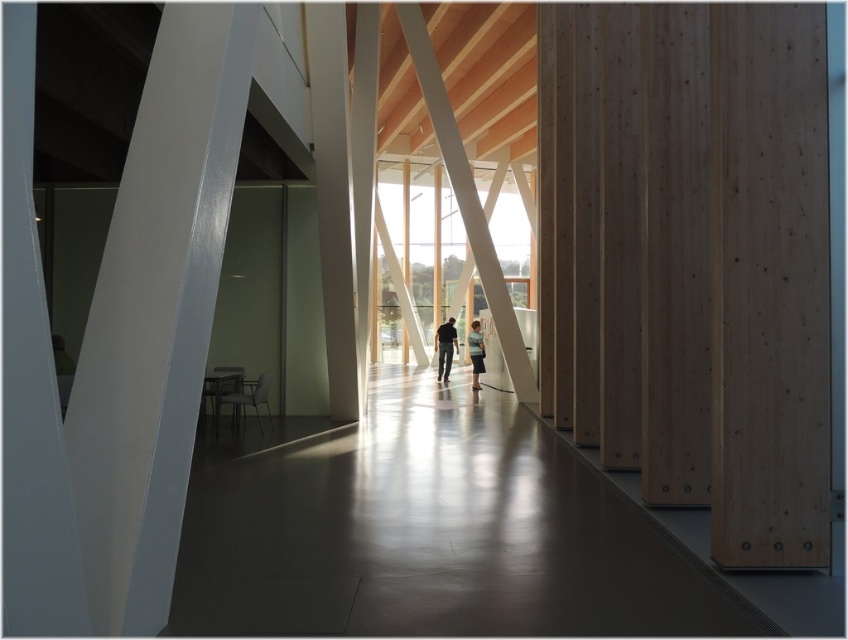
Question: Which of the following is the closest to the observer?

Choices:
 (A) light brown wooden beam at center
 (B) white glossy beam at left
 (C) matte black shirt at center

Answer: (B)

Question: Observing the image, what is the correct spatial positioning of light brown wooden beam at center in reference to matte black shirt at center?

Choices:
 (A) right
 (B) left

Answer: (A)

Question: Can you confirm if light brown wooden beam at center is positioned to the right of light blue denim jacket at center?

Choices:
 (A) no
 (B) yes

Answer: (B)

Question: Which of the following is the closest to the observer?

Choices:
 (A) (85, 460)
 (B) (456, 138)
 (C) (476, 346)
 (D) (452, 321)

Answer: (A)

Question: Is matte black shirt at center smaller than light blue denim jacket at center?

Choices:
 (A) yes
 (B) no

Answer: (A)

Question: Which is farther from the light blue denim jacket at center?

Choices:
 (A) white glossy beam at left
 (B) light brown wooden beam at center
 (C) matte black shirt at center

Answer: (A)